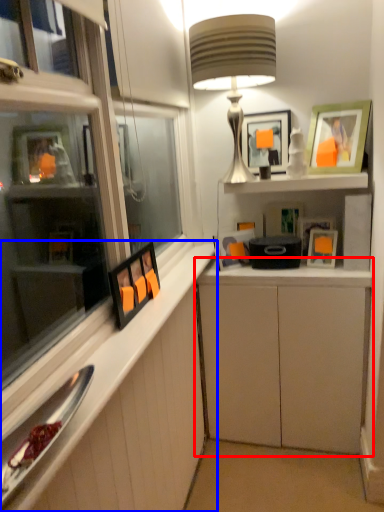
Question: Which point is further to the camera, cabinetry (highlighted by a red box) or cabinetry (highlighted by a blue box)?

Choices:
 (A) cabinetry
 (B) cabinetry

Answer: (A)